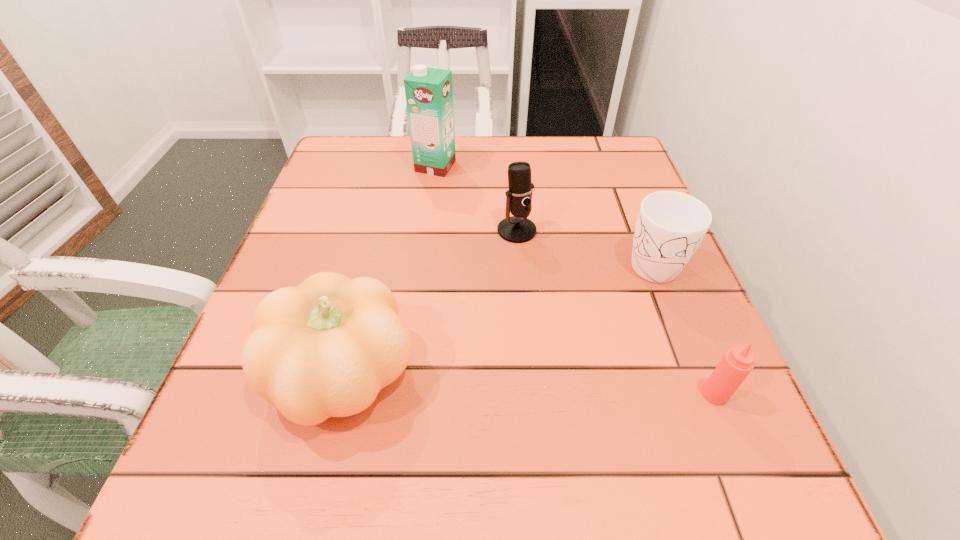
Locate an element on the screen. This screenshot has height=540, width=960. vacant space located on the left of the Tabasco sauce is located at coordinates (555, 394).

At what (x,y) coordinates should I click in order to perform the action: click on object located in the far edge section of the desktop. Please return your answer as a coordinate pair (x, y). Looking at the image, I should click on (429, 91).

I want to click on object that is positioned at the left edge, so click(x=325, y=348).

Find the location of a particular element. mug present at the right edge is located at coordinates (670, 226).

I want to click on Tabasco sauce located in the right edge section of the desktop, so click(x=737, y=363).

Locate an element on the screen. This screenshot has height=540, width=960. free space at the far edge of the desktop is located at coordinates tap(505, 181).

Where is `free space at the near edge of the desktop`? This screenshot has height=540, width=960. free space at the near edge of the desktop is located at coordinates 421,459.

In the image, there is a desktop. Where is `blank space at the left edge`? blank space at the left edge is located at coordinates (194, 446).

The width and height of the screenshot is (960, 540). Identify the location of free space at the right edge of the desktop. (604, 257).

I want to click on vacant space at the far left corner of the desktop, so point(396,139).